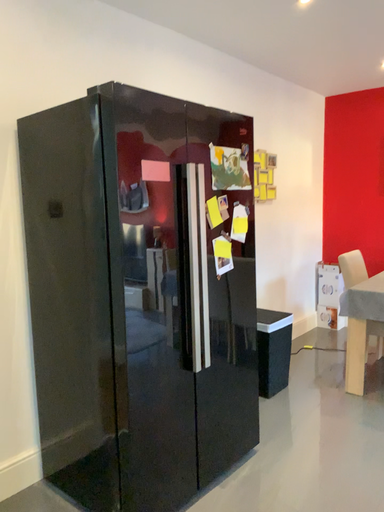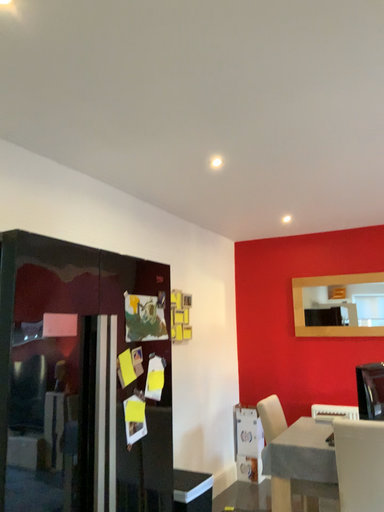
Question: Which way did the camera rotate in the video?

Choices:
 (A) rotated downward
 (B) rotated upward

Answer: (B)